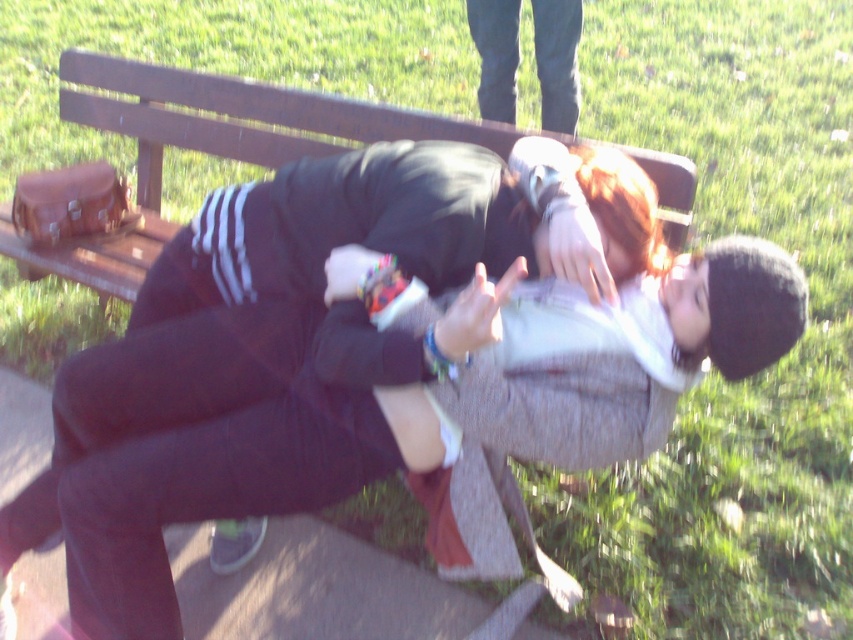
Consider the image. Does wooden bench at center appear on the left side of dark blue jeans at upper center?

Correct, you'll find wooden bench at center to the left of dark blue jeans at upper center.

Who is lower down, wooden bench at center or dark blue jeans at upper center?

wooden bench at center is lower down.

Where is `wooden bench at center`? The image size is (853, 640). wooden bench at center is located at coordinates (207, 145).

What are the coordinates of `wooden bench at center` in the screenshot? It's located at coord(207,145).